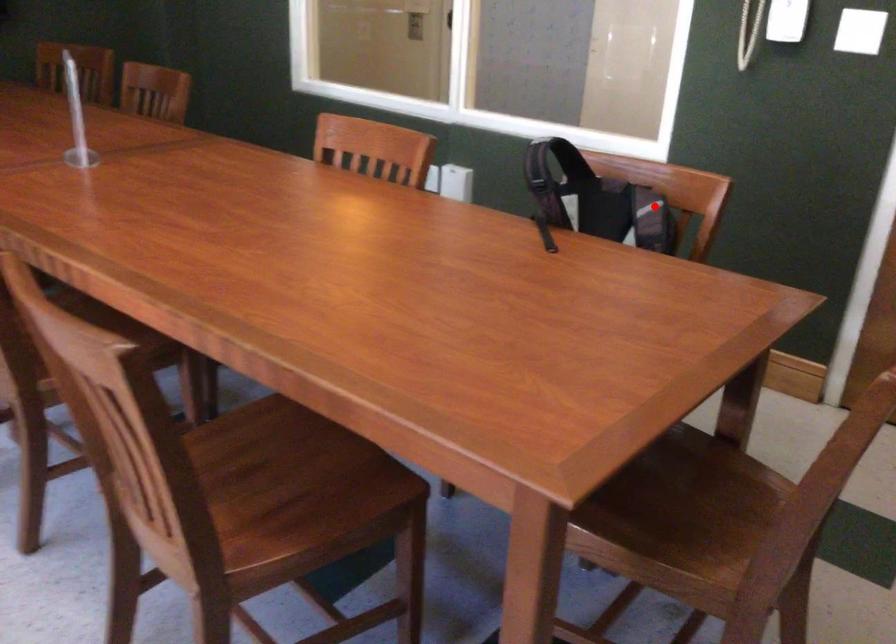
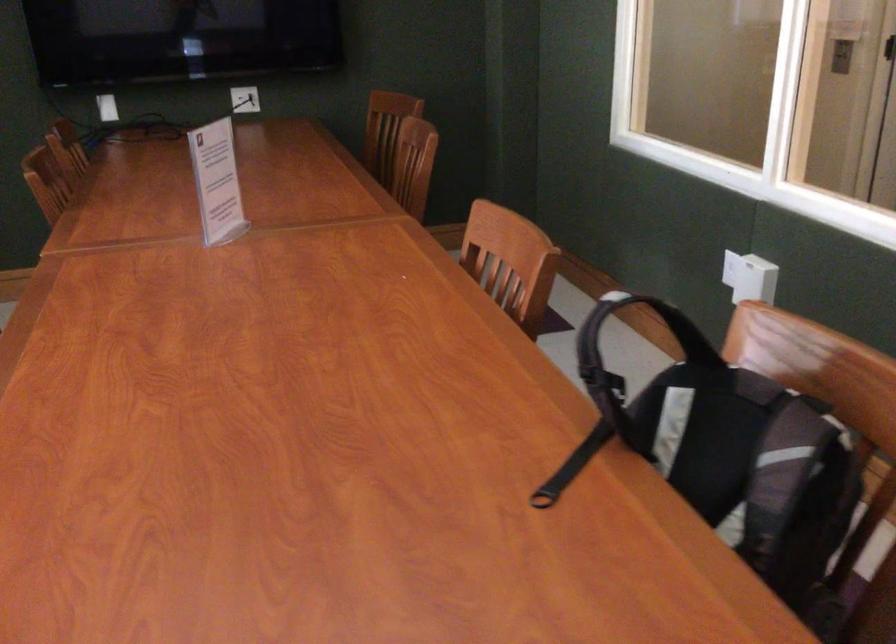
Locate, in the second image, the point that corresponds to the highlighted location in the first image.

(796, 456)